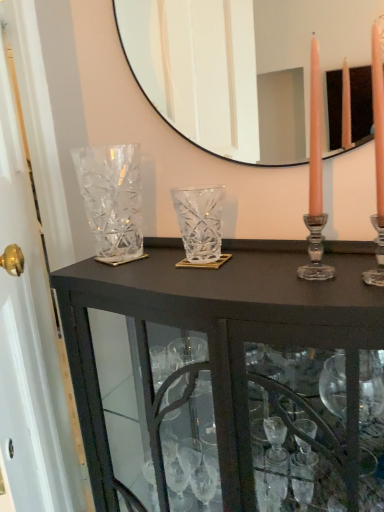
Question: Is clear glass mirror at upper center bigger or smaller than clear crystal vase at left, arranged as the 2th glass vase when viewed from the right?

Choices:
 (A) big
 (B) small

Answer: (B)

Question: From a real-world perspective, relative to clear crystal vase at left, the first glass vase viewed from the left, is clear glass mirror at upper center vertically above or below?

Choices:
 (A) below
 (B) above

Answer: (B)

Question: Which is nearer to the clear glass door at left?

Choices:
 (A) clear crystal vase at left, the first glass vase viewed from the left
 (B) clear glass cabinet at center
 (C) clear glass mirror at upper center
 (D) clear crystal vase at center, which is the 1th glass vase in right-to-left order

Answer: (A)

Question: Which of these objects is positioned farthest from the clear glass door at left?

Choices:
 (A) clear crystal vase at left, arranged as the 2th glass vase when viewed from the right
 (B) clear glass mirror at upper center
 (C) clear crystal vase at center, which is the 1th glass vase in right-to-left order
 (D) clear glass cabinet at center

Answer: (B)